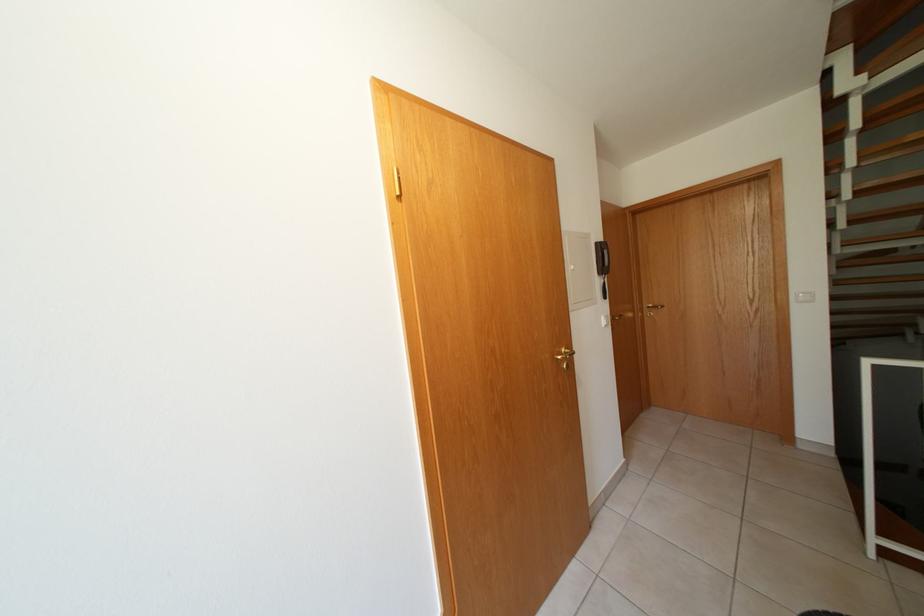
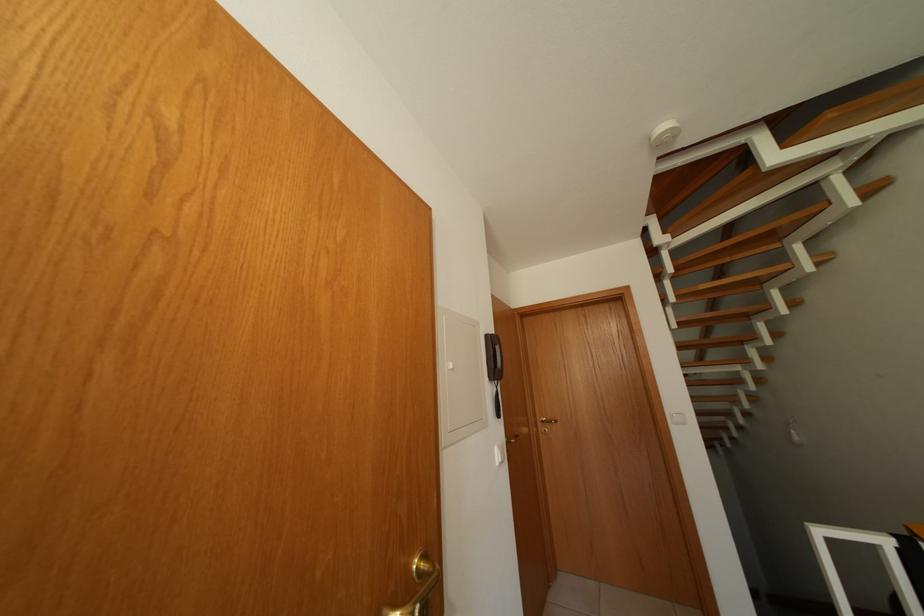
First-person continuous shooting, in which direction is the camera rotating?

The camera rotated toward right-up.